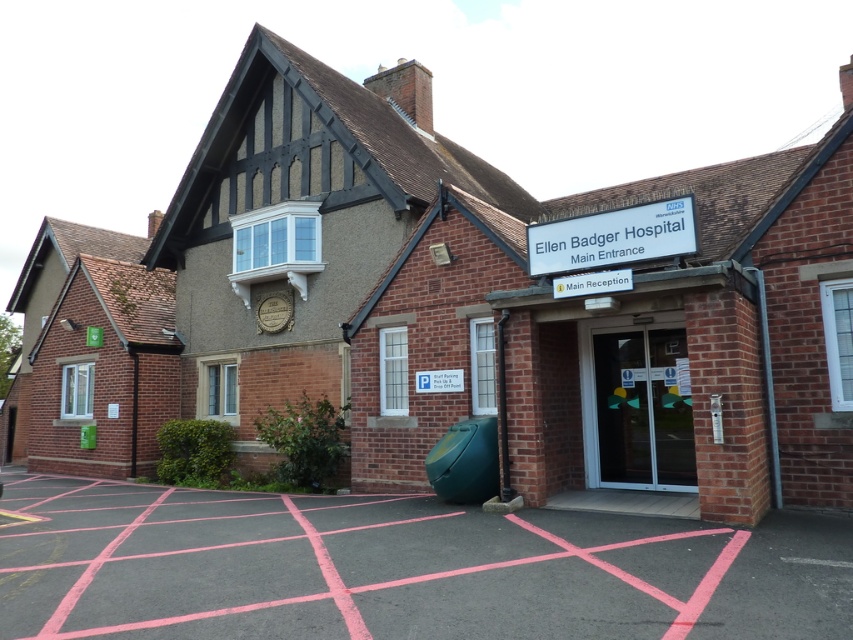
Question: Which object appears farthest from the camera in this image?

Choices:
 (A) pink asphalt parking lot at lower center
 (B) transparent glass doors at center

Answer: (B)

Question: Is pink asphalt parking lot at lower center wider than transparent glass doors at center?

Choices:
 (A) yes
 (B) no

Answer: (A)

Question: Which point appears farthest from the camera in this image?

Choices:
 (A) (656, 480)
 (B) (688, 557)

Answer: (A)

Question: Does pink asphalt parking lot at lower center appear over transparent glass doors at center?

Choices:
 (A) yes
 (B) no

Answer: (B)

Question: Can you confirm if pink asphalt parking lot at lower center is bigger than transparent glass doors at center?

Choices:
 (A) yes
 (B) no

Answer: (A)